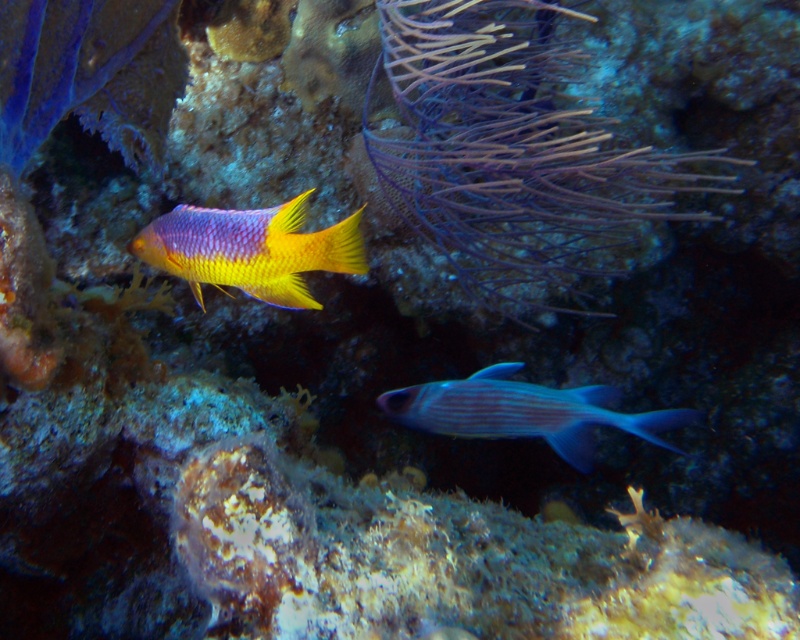
You are a scuba diver observing the underwater scene. You notice the purple soft coral at upper center and the shiny yellow fish at center. Which object is closer to you, the diver?

The purple soft coral at upper center is closer to you because it is further to the viewer than the shiny yellow fish at center.

You are a marine biologist observing the underwater scene. You notice the purple soft coral at upper center and the purple glossy fish at lower center. Which object is closer to you, the observer?

The purple soft coral at upper center is closer to you because it is in front of the purple glossy fish at lower center.

You are a marine biologist studying underwater life. You observe the shiny yellow fish at center in the image. What are the coordinates of its position?

The coordinates of the shiny yellow fish at center are at point (250, 250).